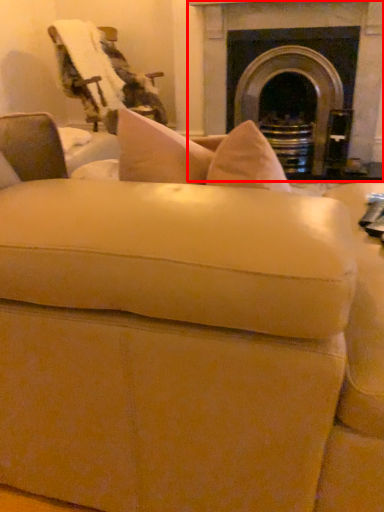
Question: From the image's perspective, what is the correct spatial positioning of fireplace (annotated by the red box) in reference to swivel chair?

Choices:
 (A) below
 (B) above

Answer: (B)